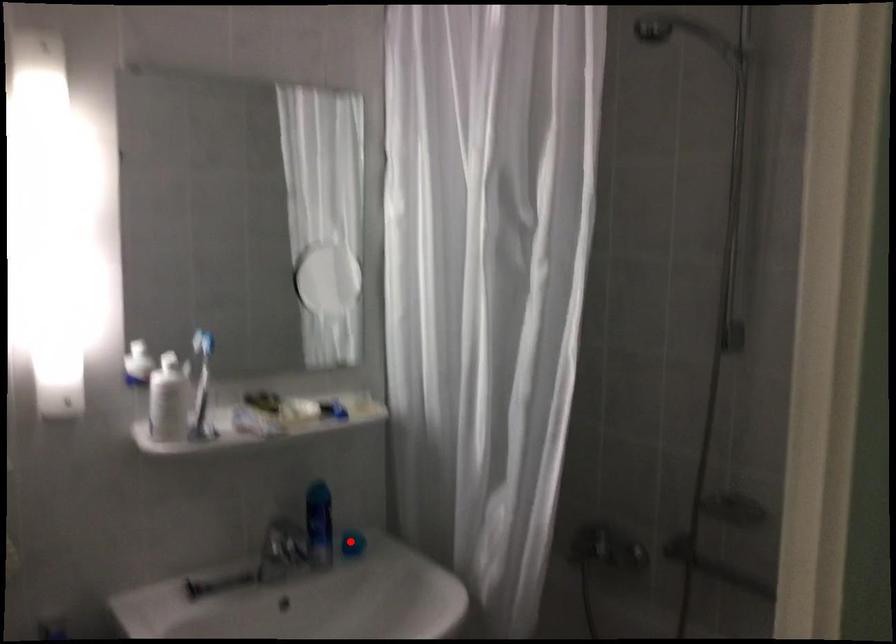
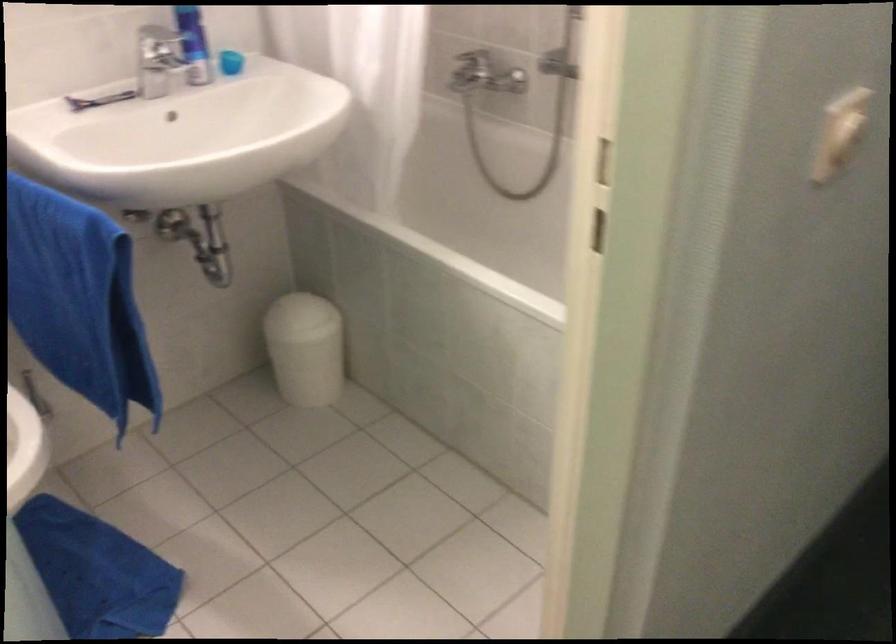
The point at the highlighted location is marked in the first image. Where is the corresponding point in the second image?

(230, 62)